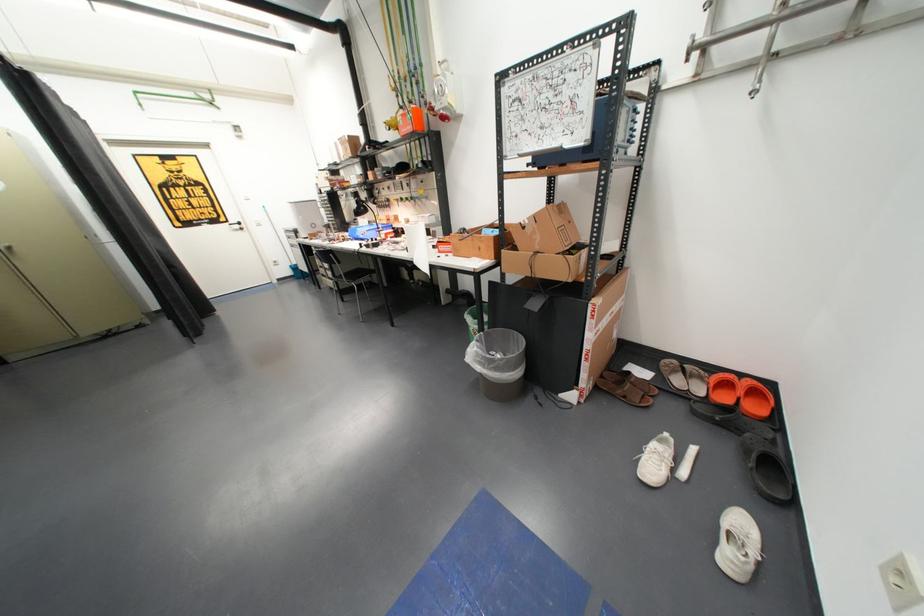
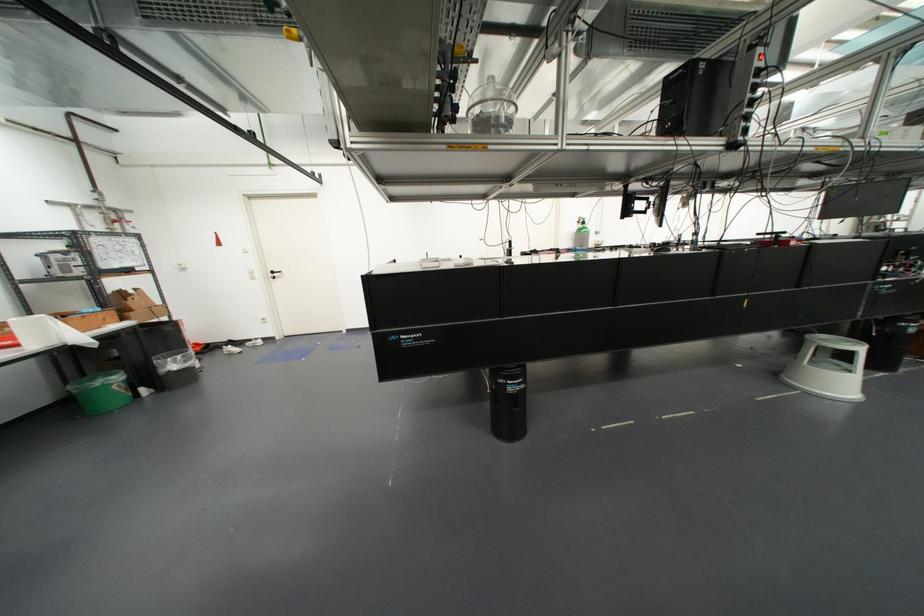
Locate, in the second image, the point that corresponds to the point at 469,329 in the first image.

(113, 387)